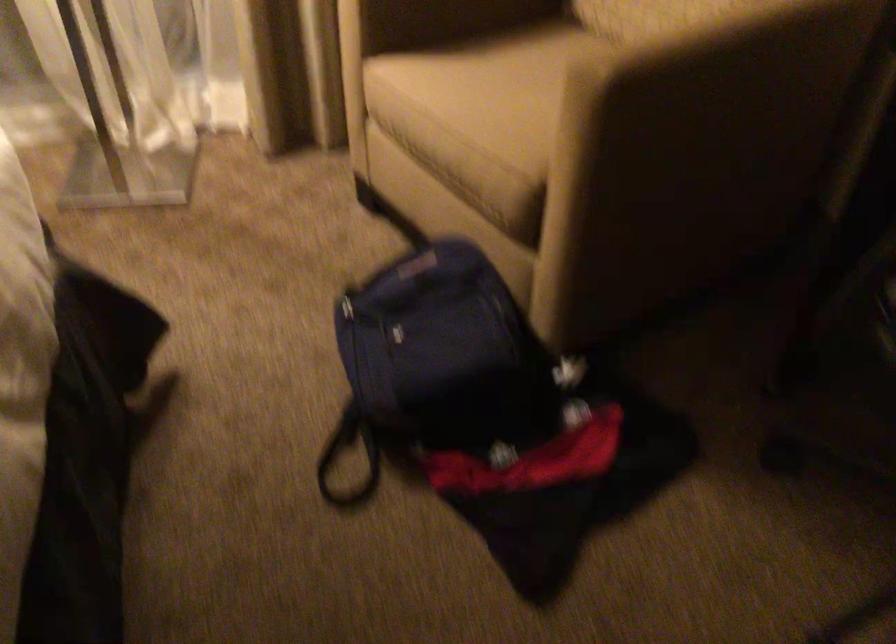
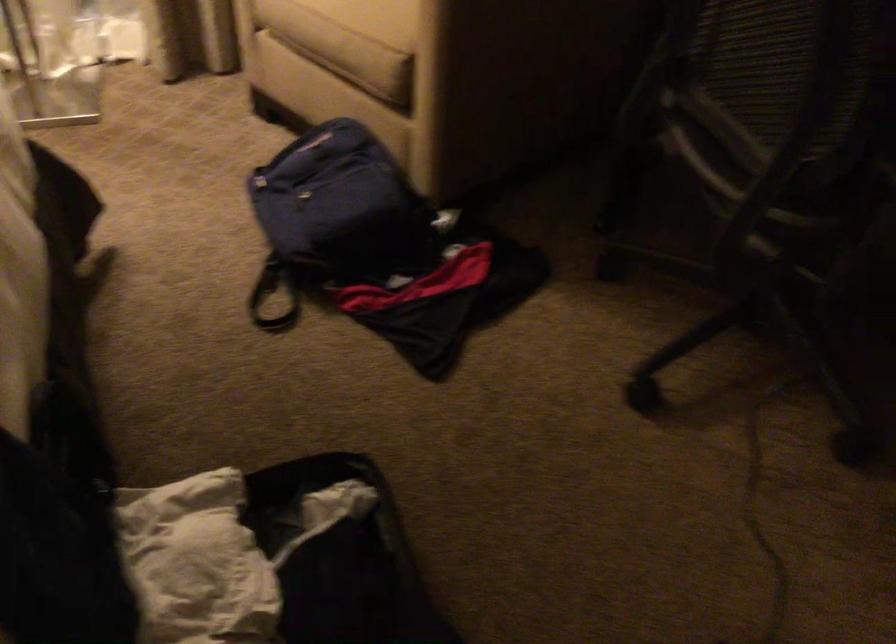
Question: The images are taken continuously from a first-person perspective. In which direction are you moving?

Choices:
 (A) Left
 (B) Right
 (C) Forward
 (D) Backward

Answer: (D)